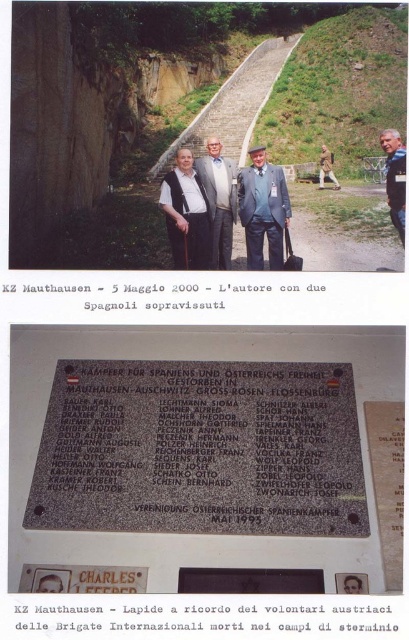
Consider the image. What is the location of the point with coordinates point (204,618)?

The point with coordinates point (204,618) is located on the black metal plaque at center.

You are a photographer standing at the center of the image. You want to take a closeup of the black metal plaque at center and the matte black vest at center. Considering their distance, which one can you focus on without moving your camera?

The matte black vest at center is closer to you than the black metal plaque at center, so you can focus on the matte black vest at center without moving your camera.